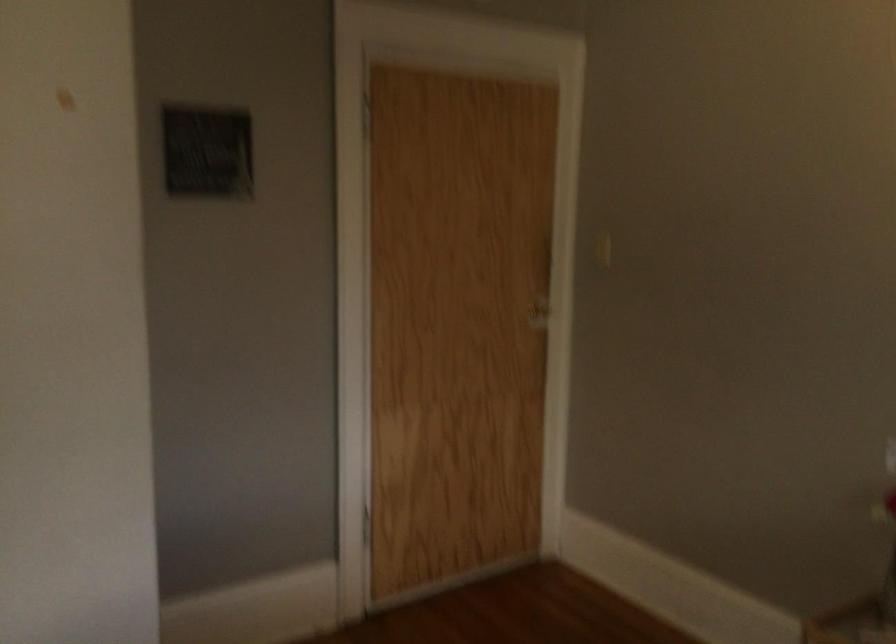
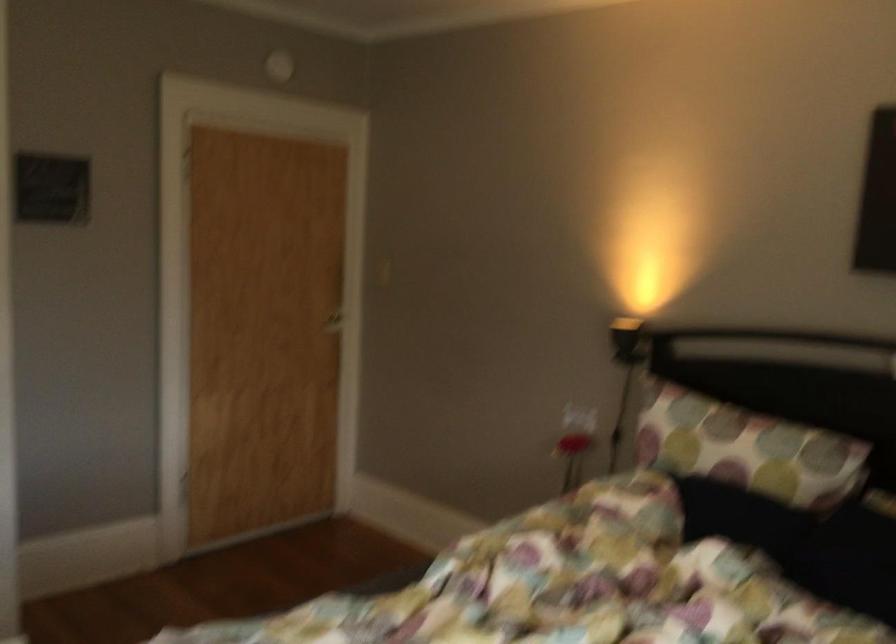
Find the pixel in the second image that matches pixel 527 317 in the first image.

(328, 319)